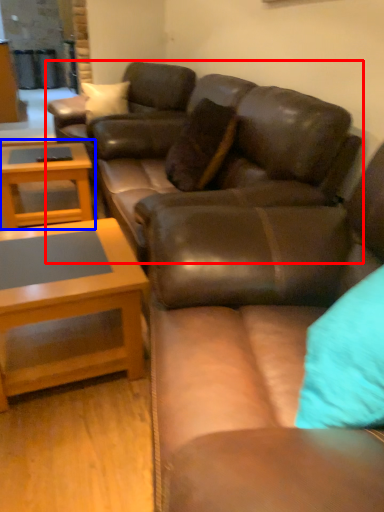
Question: Which object appears farthest to the camera in this image, studio couch (highlighted by a red box) or coffee table (highlighted by a blue box)?

Choices:
 (A) studio couch
 (B) coffee table

Answer: (B)